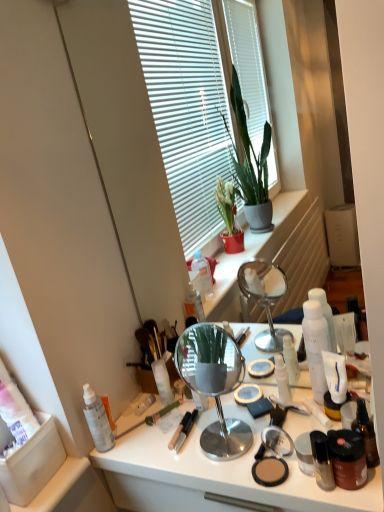
Locate an element on the screen. The height and width of the screenshot is (512, 384). vacant space that is to the left of matte brown compact at lower center is located at coordinates (205, 465).